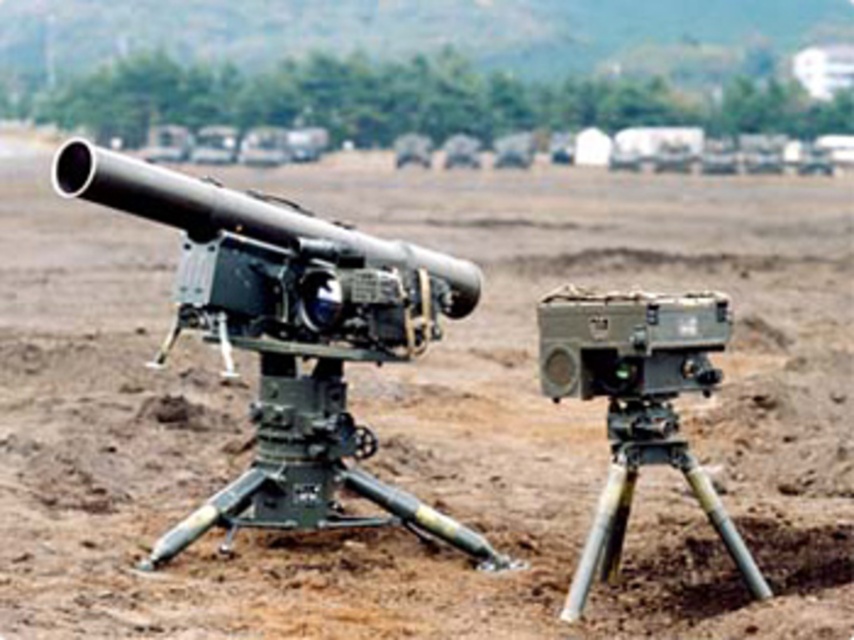
You are a GUI agent. You are given a task and a screenshot of the screen. Output one action in this format:
    pyautogui.click(x=<x>, y=<y>)
    Task: Click on the matte black cannon at center
    This screenshot has width=854, height=640.
    Given the screenshot: What is the action you would take?
    pyautogui.click(x=288, y=336)

Is matte black cannon at center smaller than matte gray video camera at center?

Incorrect, matte black cannon at center is not smaller in size than matte gray video camera at center.

You are a GUI agent. You are given a task and a screenshot of the screen. Output one action in this format:
    pyautogui.click(x=<x>, y=<y>)
    Task: Click on the matte black cannon at center
    This screenshot has height=640, width=854.
    Given the screenshot: What is the action you would take?
    pyautogui.click(x=288, y=336)